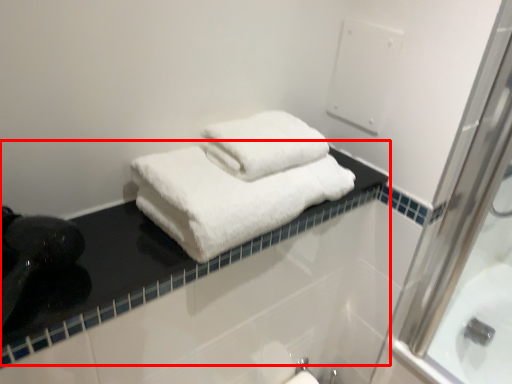
Question: In this image, where is counter top (annotated by the red box) located relative to towel?

Choices:
 (A) right
 (B) left

Answer: (B)